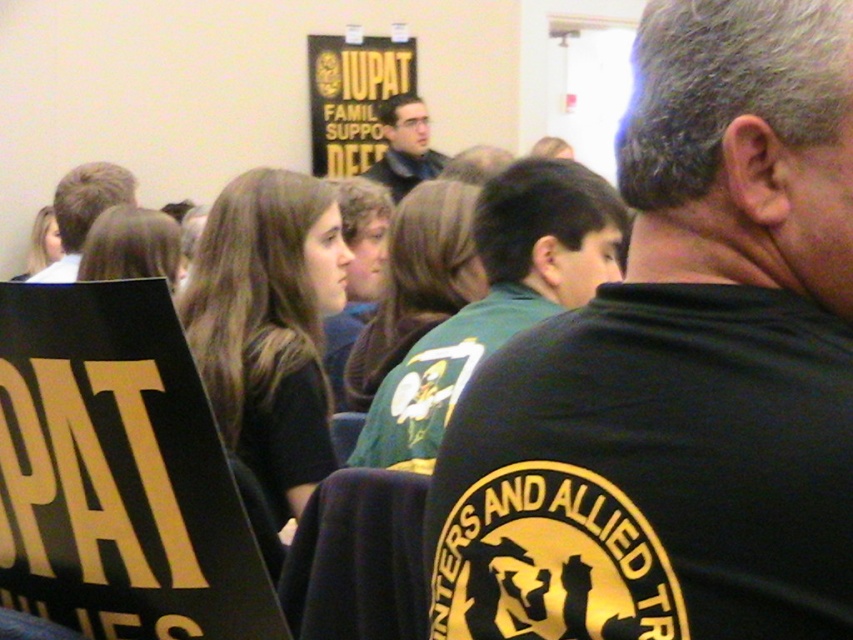
Is black t-shirt at upper right bigger than blonde hair at left?

No.

Can you confirm if black t-shirt at upper right is positioned to the right of blonde hair at left?

Correct, you'll find black t-shirt at upper right to the right of blonde hair at left.

Is point (828, 168) farther from viewer compared to point (84, 227)?

No, (828, 168) is closer to viewer.

What are the coordinates of `black t-shirt at upper right` in the screenshot? It's located at (680, 369).

Does point (480, 227) come in front of point (93, 179)?

Yes, it is in front of point (93, 179).

Which is in front, point (572, 307) or point (86, 195)?

Point (572, 307) is in front.

Locate an element on the screen. The height and width of the screenshot is (640, 853). green jersey at center is located at coordinates (498, 298).

Is black t-shirt at upper right in front of green jersey at center?

Yes.

Does black t-shirt at upper right have a larger size compared to green jersey at center?

No.

Who is more forward, [761,419] or [553,193]?

Point [761,419]

You are a GUI agent. You are given a task and a screenshot of the screen. Output one action in this format:
    pyautogui.click(x=<x>, y=<y>)
    Task: Click on the black t-shirt at upper right
    This screenshot has height=640, width=853.
    Given the screenshot: What is the action you would take?
    click(680, 369)